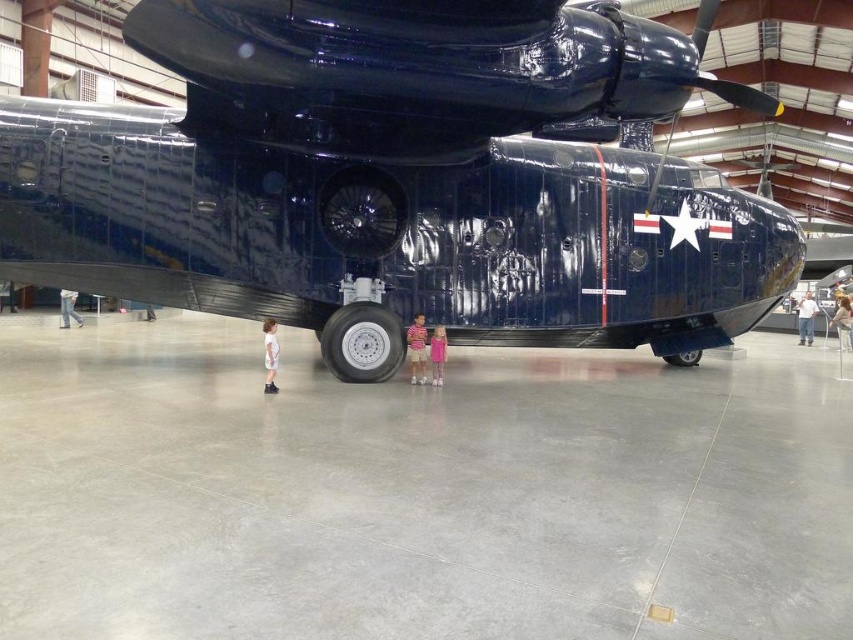
Question: Can you confirm if light blue shirt at lower right is positioned below white cotton shirt at lower left?

Choices:
 (A) no
 (B) yes

Answer: (B)

Question: Observing the image, what is the correct spatial positioning of pink fabric dress at lower center in reference to light blue shirt at lower right?

Choices:
 (A) above
 (B) below

Answer: (B)

Question: Where is polished dark blue propeller at upper center located in relation to pink fabric dress at lower center in the image?

Choices:
 (A) below
 (B) above

Answer: (B)

Question: Which is nearer to the pink fabric dress at lower center?

Choices:
 (A) pink fabric dress at center
 (B) glossy blue airplane at center
 (C) polished dark blue propeller at upper center

Answer: (A)

Question: Which object is positioned farthest from the pink fabric dress at center?

Choices:
 (A) glossy blue airplane at center
 (B) white shirt at center

Answer: (B)

Question: Which of these objects is positioned farthest from the pink fabric dress at lower center?

Choices:
 (A) glossy blue airplane at center
 (B) striped shirt at center
 (C) light blue shirt at lower right
 (D) white cotton shirt at lower left

Answer: (C)